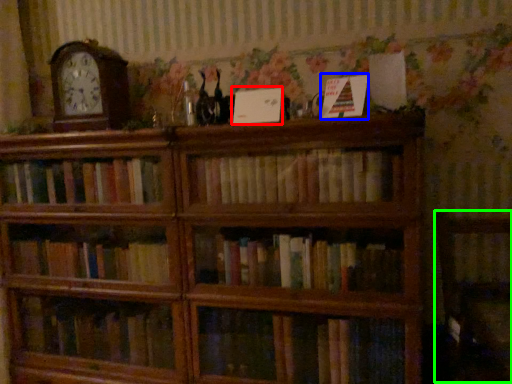
Question: Based on their relative distances, which object is nearer to paperback book (highlighted by a red box)? Choose from paperback book (highlighted by a blue box) and armchair (highlighted by a green box).

Choices:
 (A) paperback book
 (B) armchair

Answer: (A)